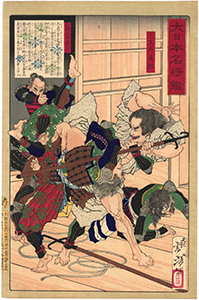
At what (x,y) coordinates should I click in order to perform the action: click on art. Please return your answer as a coordinate pair (x, y). Looking at the image, I should click on (34, 42).